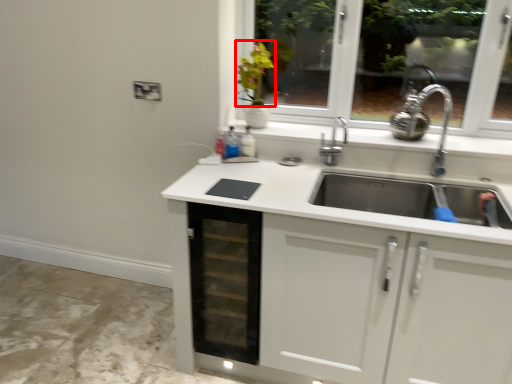
Question: From the image's perspective, what is the correct spatial positioning of flower (annotated by the red box) in reference to drawer?

Choices:
 (A) below
 (B) above

Answer: (B)